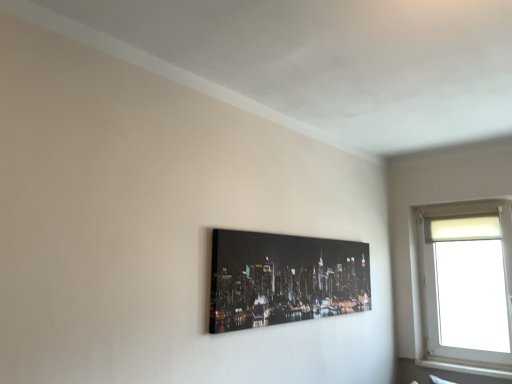
Question: From their relative heights in the image, would you say black glossy canvas at center is taller or shorter than white plastic window at upper right?

Choices:
 (A) short
 (B) tall

Answer: (A)

Question: In the image, is black glossy canvas at center positioned in front of or behind white plastic window at upper right?

Choices:
 (A) front
 (B) behind

Answer: (A)

Question: From a real-world perspective, is black glossy canvas at center physically located above or below white plastic window at upper right?

Choices:
 (A) below
 (B) above

Answer: (B)

Question: Is white plastic window at upper right wider or thinner than black glossy canvas at center?

Choices:
 (A) wide
 (B) thin

Answer: (A)

Question: Looking at the image, does white plastic window at upper right seem bigger or smaller compared to black glossy canvas at center?

Choices:
 (A) small
 (B) big

Answer: (B)

Question: Considering their positions, is white plastic window at upper right located in front of or behind black glossy canvas at center?

Choices:
 (A) front
 (B) behind

Answer: (B)

Question: Based on their positions, is white plastic window at upper right located to the left or right of black glossy canvas at center?

Choices:
 (A) left
 (B) right

Answer: (B)